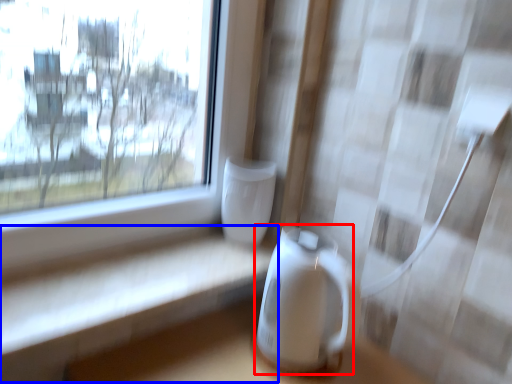
Question: Among these objects, which one is nearest to the camera, appliance (highlighted by a red box) or table (highlighted by a blue box)?

Choices:
 (A) appliance
 (B) table

Answer: (B)